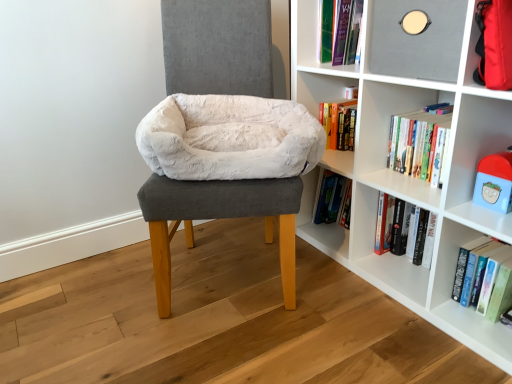
Image resolution: width=512 pixels, height=384 pixels. Identify the location of free point below white plush pet bed at center (from a real-world perspective). (232, 270).